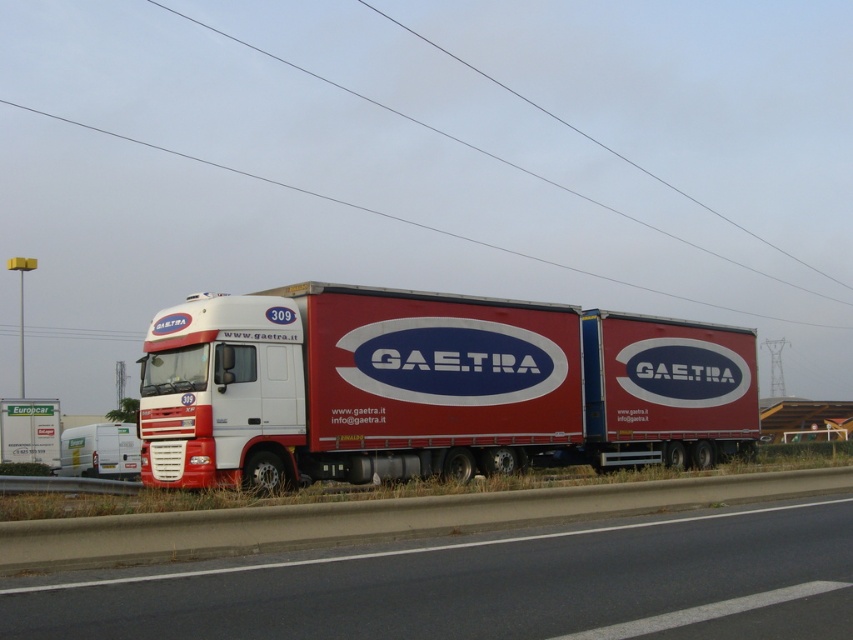
Question: Estimate the real-world distances between objects in this image. Which object is closer to the white matte trailer at lower left?

Choices:
 (A) blackcablepower line at upper center
 (B) red matte trailer truck at center
 (C) black asphalt highway at center

Answer: (B)

Question: Considering the real-world distances, which object is farthest from the blackcablepower line at upper center?

Choices:
 (A) red matte trailer truck at center
 (B) white matte trailer at lower left

Answer: (A)

Question: Does black asphalt highway at center appear under white matte trailer at lower left?

Choices:
 (A) yes
 (B) no

Answer: (B)

Question: Does red matte trailer truck at center have a lesser width compared to black asphalt highway at center?

Choices:
 (A) yes
 (B) no

Answer: (B)

Question: Is blackcablepower line at upper center above white matte trailer at lower left?

Choices:
 (A) no
 (B) yes

Answer: (B)

Question: Considering the real-world distances, which object is closest to the blackcablepower line at upper center?

Choices:
 (A) black asphalt highway at center
 (B) red matte trailer truck at center

Answer: (B)